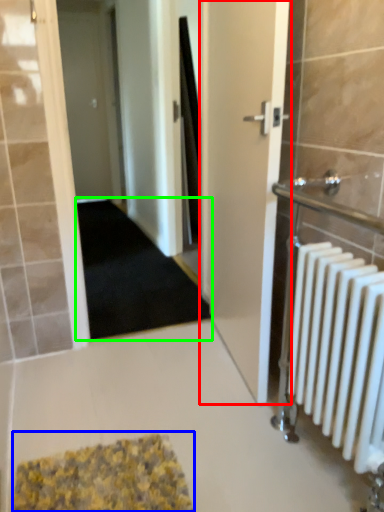
Question: Which is nearer to the door (highlighted by a red box)? bath mat (highlighted by a blue box) or doormat (highlighted by a green box).

Choices:
 (A) bath mat
 (B) doormat

Answer: (A)